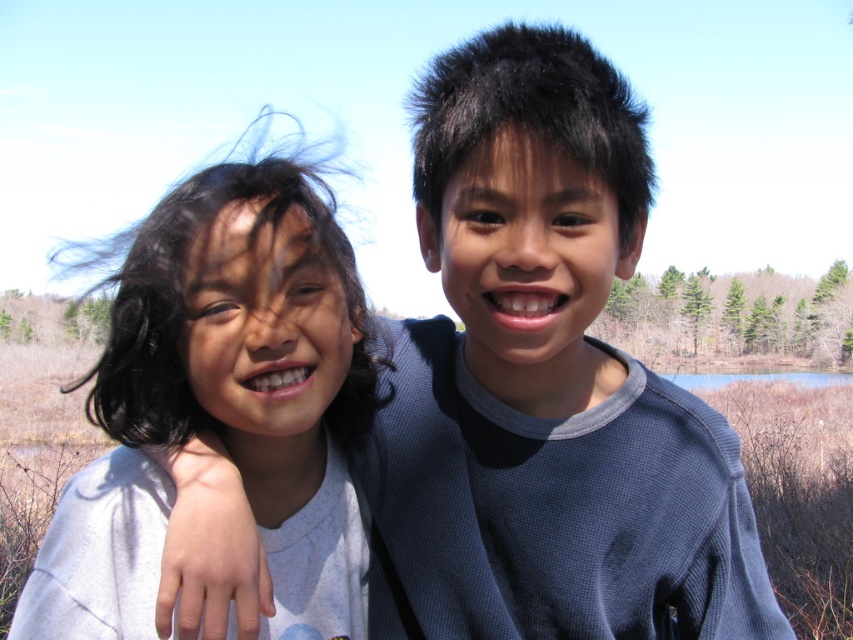
You are a photographer trying to capture a clear shot of both the gray thermal shirt at center and the white matte shirt at left. Based on their positions, which shirt should you focus on first to ensure both are in sharp focus?

The gray thermal shirt at center is closer to the viewer than the white matte shirt at left. To ensure both are in sharp focus, you should focus on the gray thermal shirt at center first, as it is closer, and the depth of field may naturally include the white matte shirt at left if focused properly.

You are a photographer setting up a shoot in the given scene. You need to ensure that the gray thermal shirt at center and the white matte shirt at left are both visible in the frame. Based on their positions, which shirt is covering part of the other?

The gray thermal shirt at center is positioned over the white matte shirt at left, so it is covering part of it.